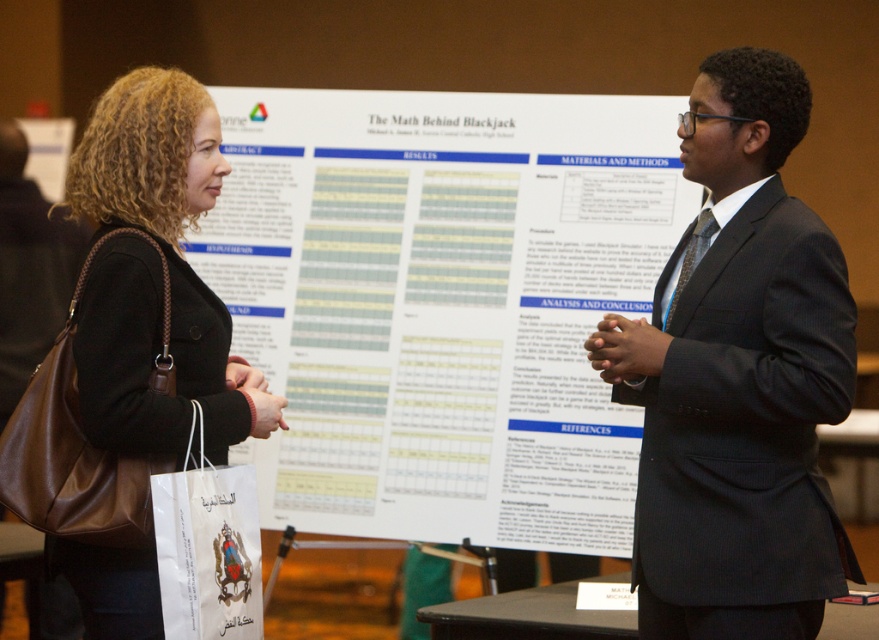
You are attending a conference and need to locate your black leather bag at left. You see the white paper poster at center. Which direction should you move relative to the poster to find your bag?

The black leather bag at left is to the left of the white paper poster at center, so you should move to the left of the poster to find your bag.

You are an event organizer who needs to hang a new banner that is 2 meters wide. The banner must be placed between the white paper poster at center and the dark gray suit at center. Is there enough space between them to accommodate the banner?

The white paper poster at center is wider than the dark gray suit at center. However, the exact distance between them isn not specified in the provided information. Therefore, it is uncertain if there is enough space to place a 2 meter wide banner between them.

You are an event organizer who needs to hang a new banner that is 1.2 meters wide. The banner must be placed between the white paper poster at center and the black leather bag at left. Based on their widths, will the banner fit in the space between them?

The white paper poster at center is wider than the black leather bag at left. However, the exact width difference isn not specified, so it is uncertain if the 1.2 meter banner will fit between them without more information about the available space.